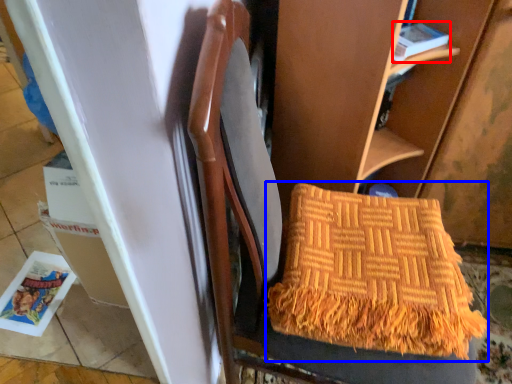
Question: Which object is further to the camera taking this photo, magazine (highlighted by a red box) or blanket (highlighted by a blue box)?

Choices:
 (A) magazine
 (B) blanket

Answer: (A)